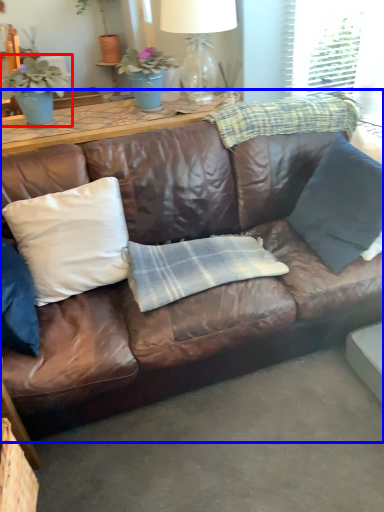
Question: Which point is closer to the camera, houseplant (highlighted by a red box) or studio couch (highlighted by a blue box)?

Choices:
 (A) houseplant
 (B) studio couch

Answer: (B)